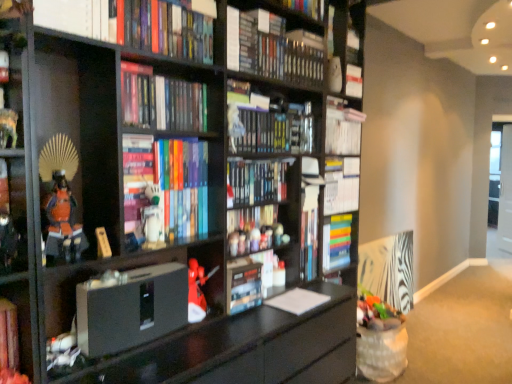
Identify the location of vacant space situated above hardcover books at upper center, the 5th book in the top-to-bottom sequence (from a real-world perspective). (155, 74).